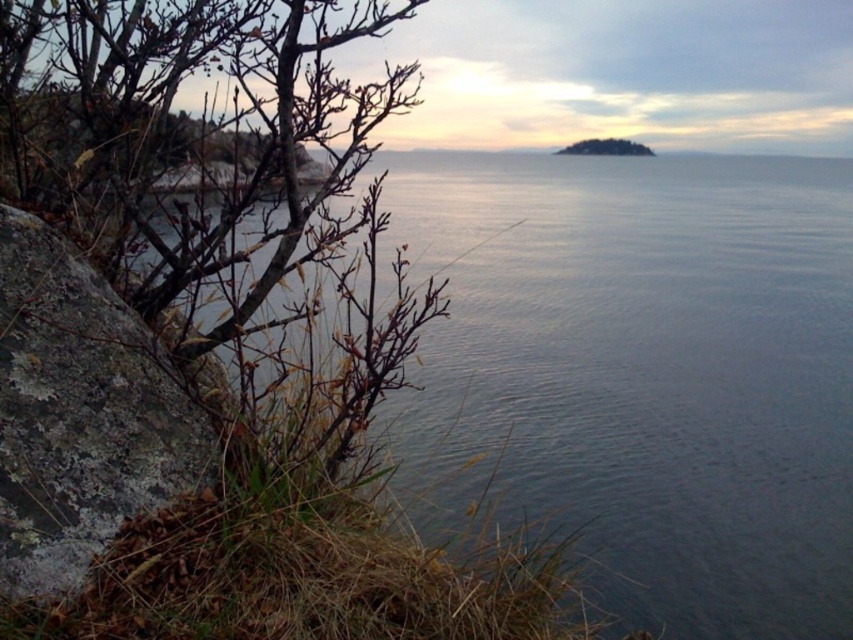
Question: Among these objects, which one is farthest from the camera?

Choices:
 (A) brown bark tree at left
 (B) green leafy island at center
 (C) smooth blue water at center
 (D) lichen-covered rock at left

Answer: (B)

Question: Which point appears farthest from the camera in this image?

Choices:
 (A) (91, 368)
 (B) (599, 140)
 (C) (782, 554)
 (D) (41, 168)

Answer: (B)

Question: Can you confirm if smooth blue water at center is wider than brown bark tree at left?

Choices:
 (A) no
 (B) yes

Answer: (B)

Question: Is smooth blue water at center below brown bark tree at left?

Choices:
 (A) no
 (B) yes

Answer: (B)

Question: Estimate the real-world distances between objects in this image. Which object is farther from the lichen-covered rock at left?

Choices:
 (A) smooth blue water at center
 (B) brown bark tree at left
 (C) green leafy island at center

Answer: (C)

Question: Is brown bark tree at left closer to camera compared to lichen-covered rock at left?

Choices:
 (A) yes
 (B) no

Answer: (B)